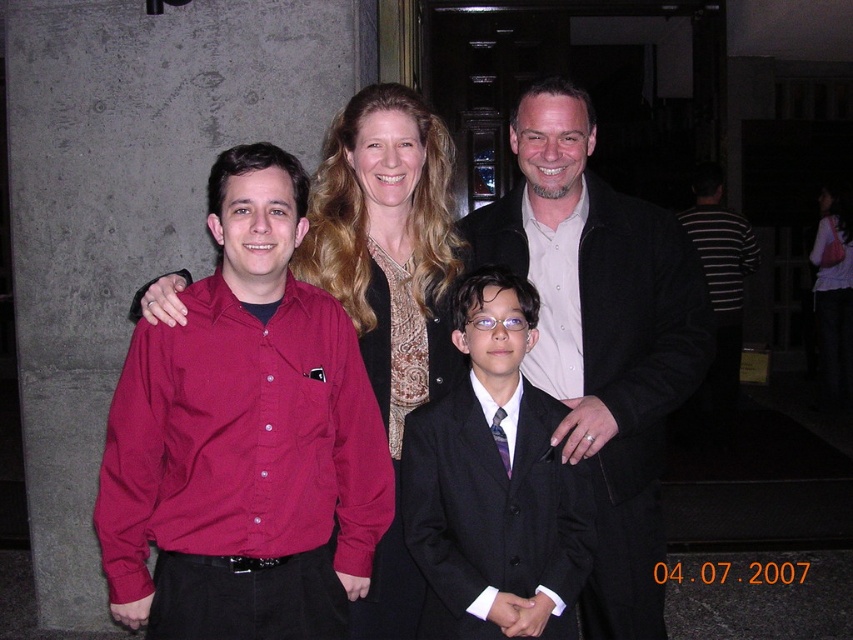
Question: Which object appears farthest from the camera in this image?

Choices:
 (A) black satin suit at center
 (B) striped cotton shirt at right
 (C) matte black suit at center

Answer: (B)

Question: Can you confirm if matte black suit at center is positioned to the left of striped cotton shirt at right?

Choices:
 (A) no
 (B) yes

Answer: (B)

Question: Which of the following is the closest to the observer?

Choices:
 (A) (442, 573)
 (B) (752, 269)
 (C) (376, 362)

Answer: (A)

Question: Does matte gold necklace at center have a larger size compared to striped cotton shirt at right?

Choices:
 (A) no
 (B) yes

Answer: (A)

Question: Among these objects, which one is nearest to the camera?

Choices:
 (A) striped cotton shirt at right
 (B) matte gold necklace at center
 (C) black satin suit at center
 (D) matte black suit at center

Answer: (C)

Question: Does matte black suit at center have a smaller size compared to matte gold necklace at center?

Choices:
 (A) no
 (B) yes

Answer: (A)